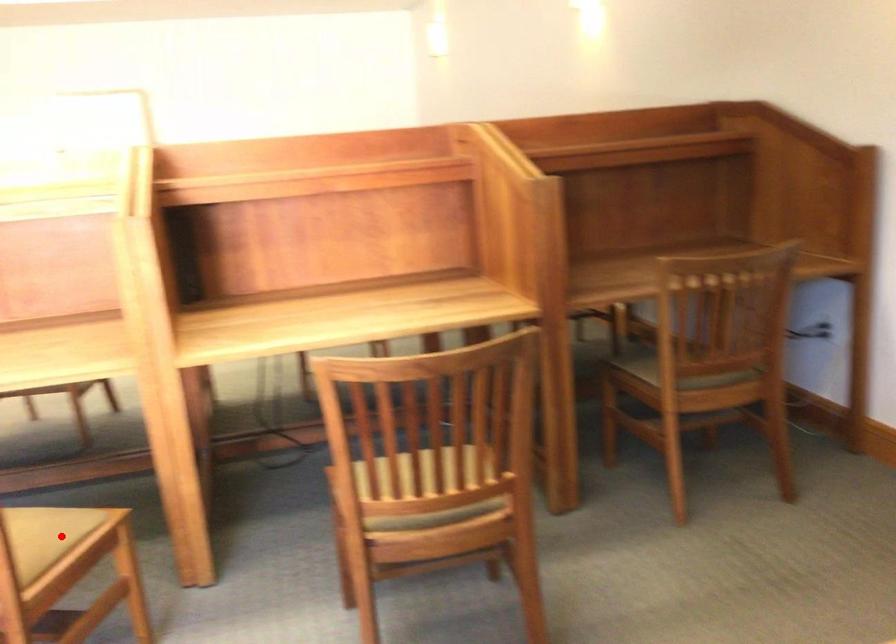
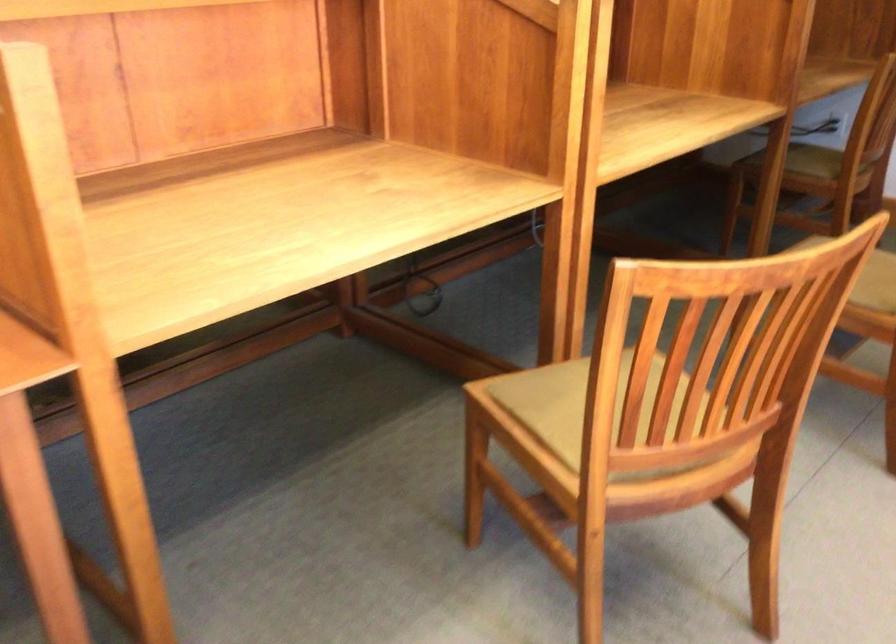
Question: I am providing you with two images of the same scene from different viewpoints. A red point is marked on the first image. Can you still see the location of the red point in image 2?

Choices:
 (A) Yes
 (B) No

Answer: (B)